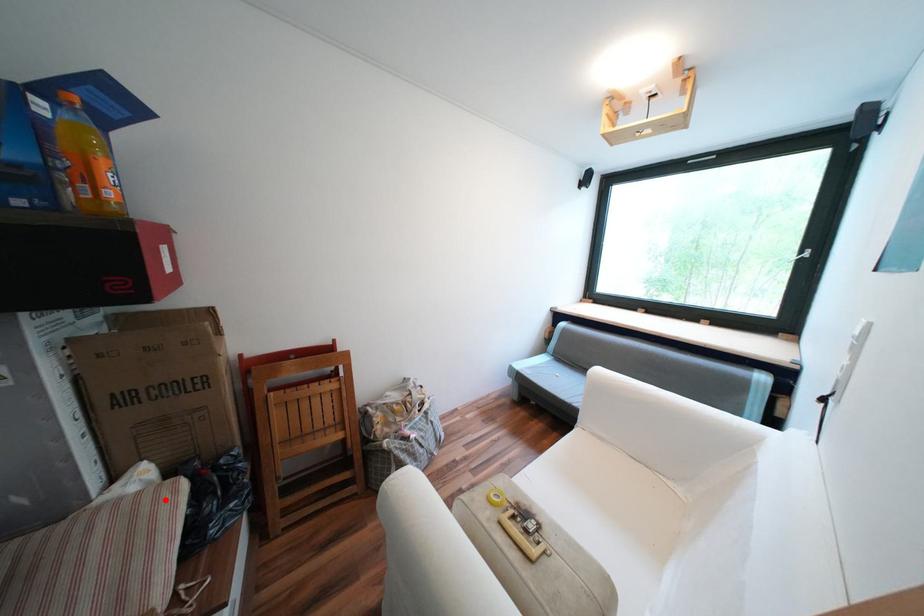
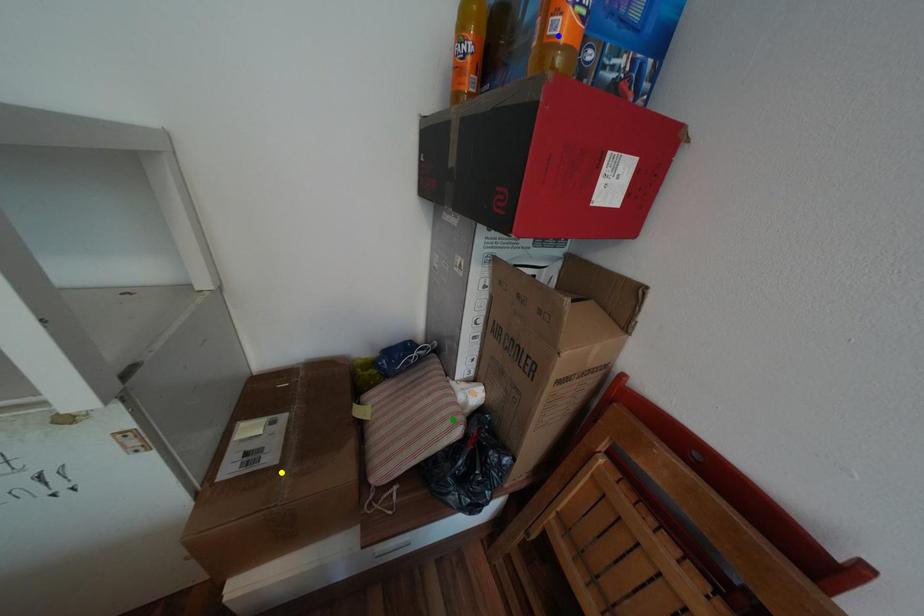
Question: I am providing you with two images of the same scene from different viewpoints. A red point is marked on the first image. You are given multiple points on the second image. Which point in image 2 represents the same 3d spot as the red point in image 1?

Choices:
 (A) green point
 (B) blue point
 (C) yellow point

Answer: (A)